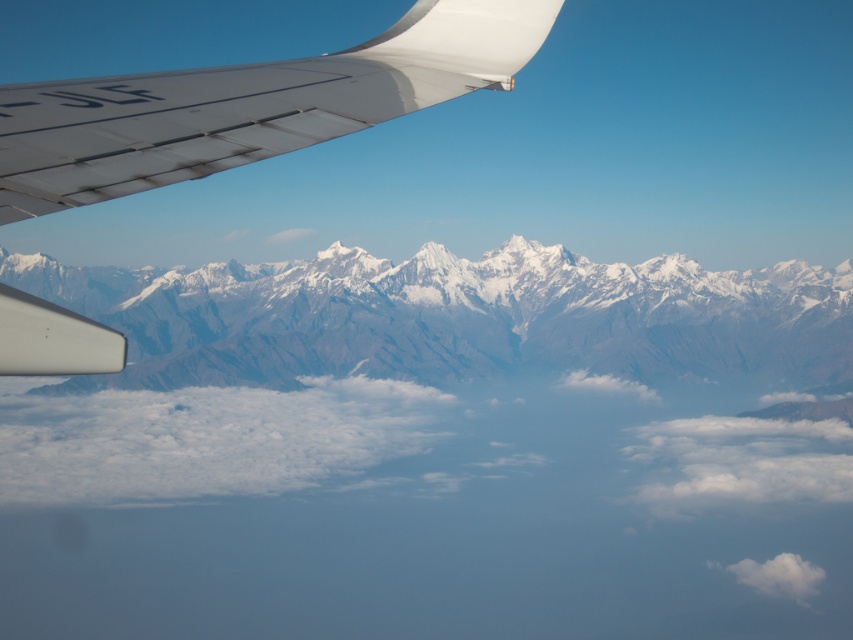
Does snowy granite mountains at center appear on the right side of matte white wing at upper left?

No, snowy granite mountains at center is not to the right of matte white wing at upper left.

Who is lower down, snowy granite mountains at center or matte white wing at upper left?

snowy granite mountains at center is below.

Between point (627, 362) and point (276, 108), which one is positioned in front?

Point (276, 108) is in front.

The width and height of the screenshot is (853, 640). What are the coordinates of `snowy granite mountains at center` in the screenshot? It's located at (456, 316).

Between point (346, 60) and point (811, 563), which one is positioned in front?

Point (346, 60) is more forward.

Is point (190, 161) positioned before point (728, 566)?

Yes.

This screenshot has width=853, height=640. What are the coordinates of `matte white wing at upper left` in the screenshot? It's located at (248, 104).

Does snowy granite mountains at center have a larger size compared to white fluffy cloud at lower right?

Yes, snowy granite mountains at center is bigger than white fluffy cloud at lower right.

Does snowy granite mountains at center appear on the left side of white fluffy cloud at lower right?

Correct, you'll find snowy granite mountains at center to the left of white fluffy cloud at lower right.

Looking at this image, measure the distance between snowy granite mountains at center and camera.

snowy granite mountains at center is 644.43 meters from camera.

Locate an element on the screen. The width and height of the screenshot is (853, 640). snowy granite mountains at center is located at coordinates (x=456, y=316).